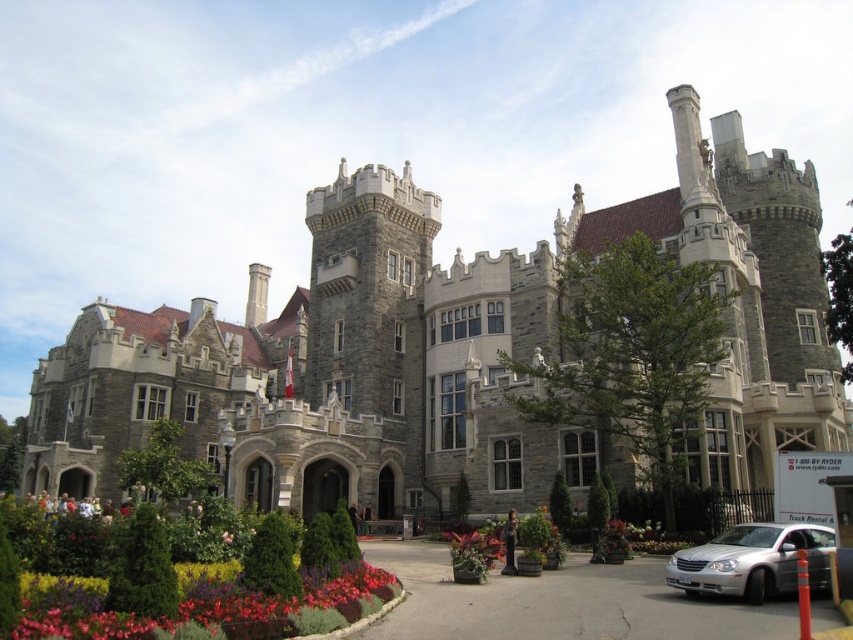
Question: Is vivid multicolored flowers at lower center above silver metallic sedan at lower right?

Choices:
 (A) yes
 (B) no

Answer: (B)

Question: From the image, what is the correct spatial relationship of vivid multicolored flowers at lower center in relation to silver metallic sedan at lower right?

Choices:
 (A) above
 (B) below

Answer: (B)

Question: Can you confirm if silver metallic sedan at lower right is positioned to the right of pink matte flower at center?

Choices:
 (A) yes
 (B) no

Answer: (A)

Question: Which of the following is the closest to the observer?

Choices:
 (A) (682, 556)
 (B) (454, 564)
 (C) (225, 538)

Answer: (A)

Question: Which object appears farthest from the camera in this image?

Choices:
 (A) green leafy bush at center
 (B) gray stone castle at center

Answer: (B)

Question: Which point appears farthest from the camera in this image?

Choices:
 (A) (717, 556)
 (B) (428, 269)

Answer: (B)